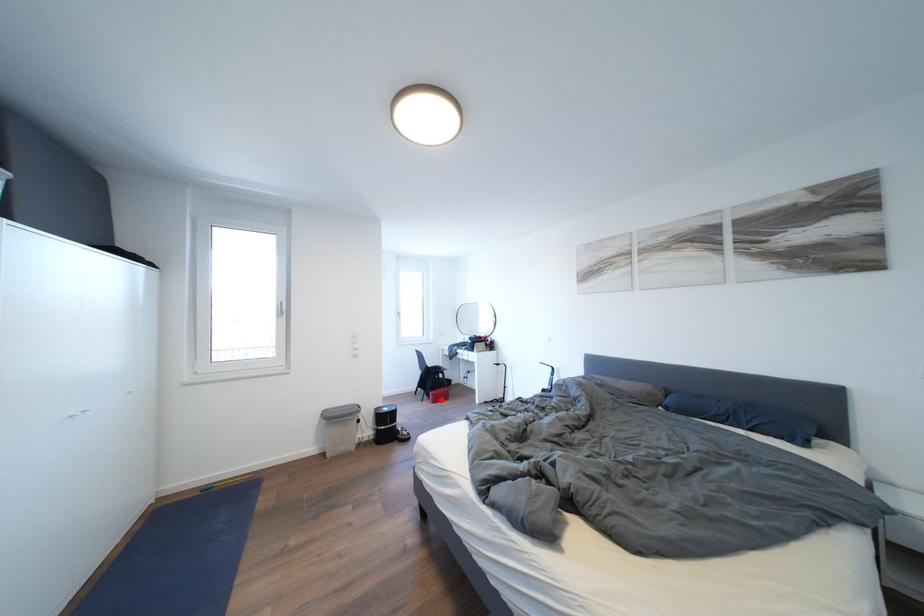
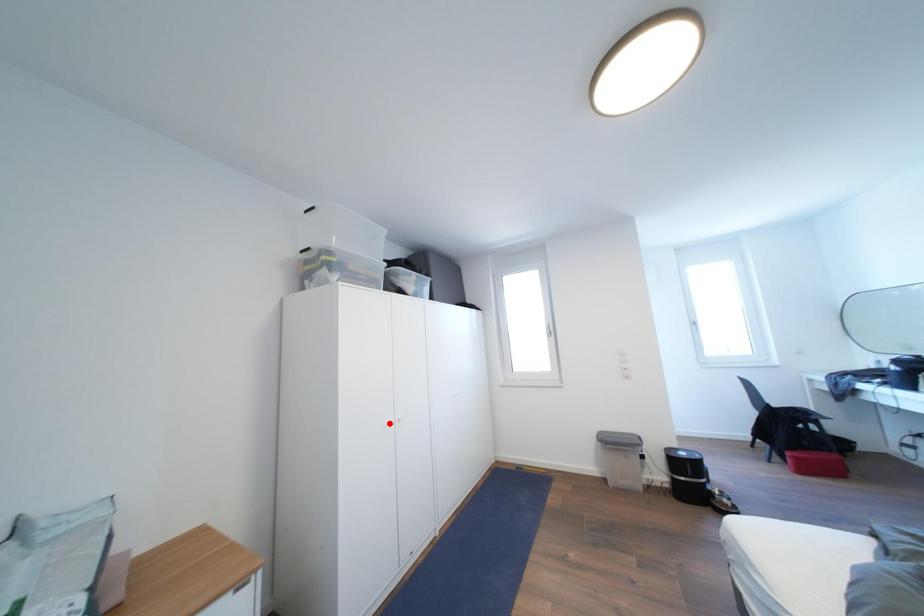
I am providing you with two images of the same scene from different viewpoints. A red point is marked on the first image and another point is marked on the second image. Is the marked point in image1 the same physical position as the marked point in image2?

No